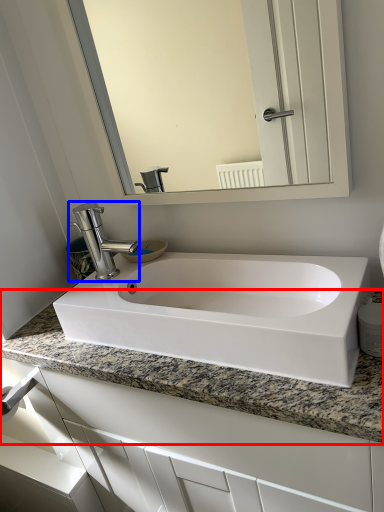
Question: Which point is closer to the camera, countertop (highlighted by a red box) or tap (highlighted by a blue box)?

Choices:
 (A) countertop
 (B) tap

Answer: (A)